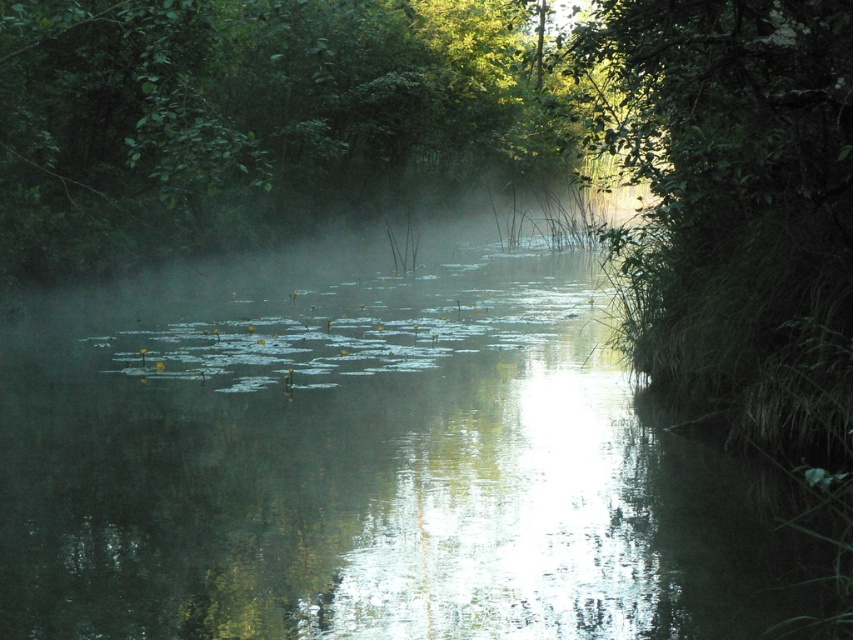
Is point (310, 532) less distant than point (222, 36)?

Yes.

Between green reflective water at center and green leafy tree at upper center, which one has less height?

green reflective water at center

Find the location of a particular element. Image resolution: width=853 pixels, height=640 pixels. green reflective water at center is located at coordinates (364, 460).